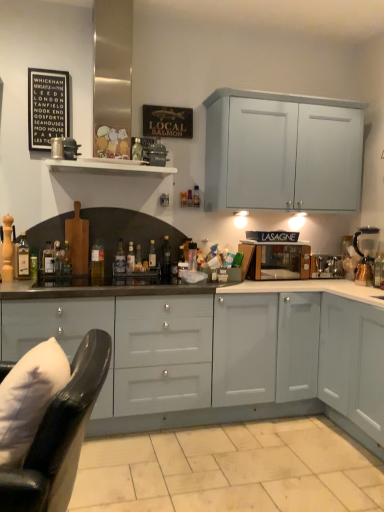
This screenshot has height=512, width=384. I want to click on unoccupied region to the right of translucent glass bottle at left, which is the 10th bottle in right-to-left order, so click(48, 283).